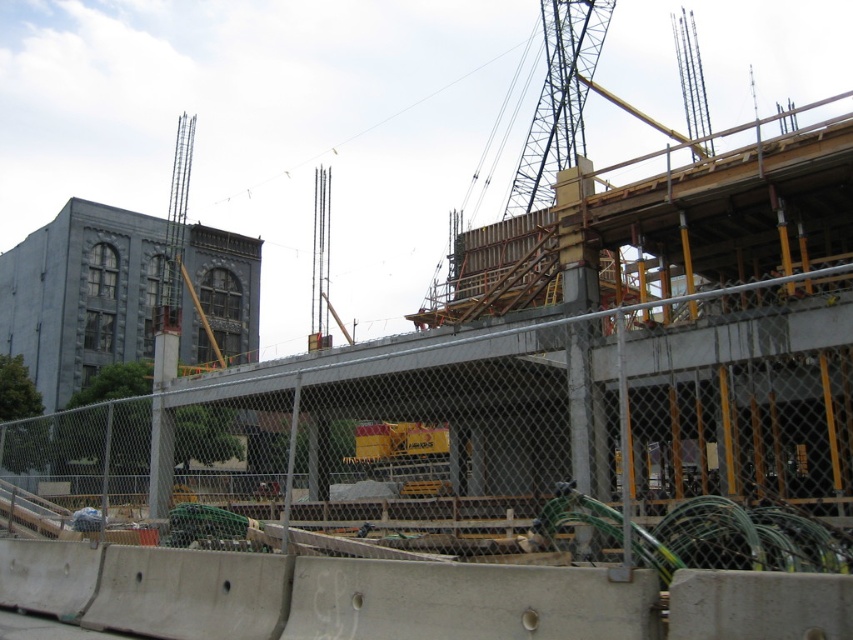
Does metal mesh fence at center appear on the right side of metallic gray crane at upper right?

Incorrect, metal mesh fence at center is not on the right side of metallic gray crane at upper right.

Is metal mesh fence at center above metallic gray crane at upper right?

Actually, metal mesh fence at center is below metallic gray crane at upper right.

The height and width of the screenshot is (640, 853). What do you see at coordinates (474, 429) in the screenshot?
I see `metal mesh fence at center` at bounding box center [474, 429].

At what (x,y) coordinates should I click in order to perform the action: click on metal mesh fence at center. Please return your answer as a coordinate pair (x, y). Looking at the image, I should click on (474, 429).